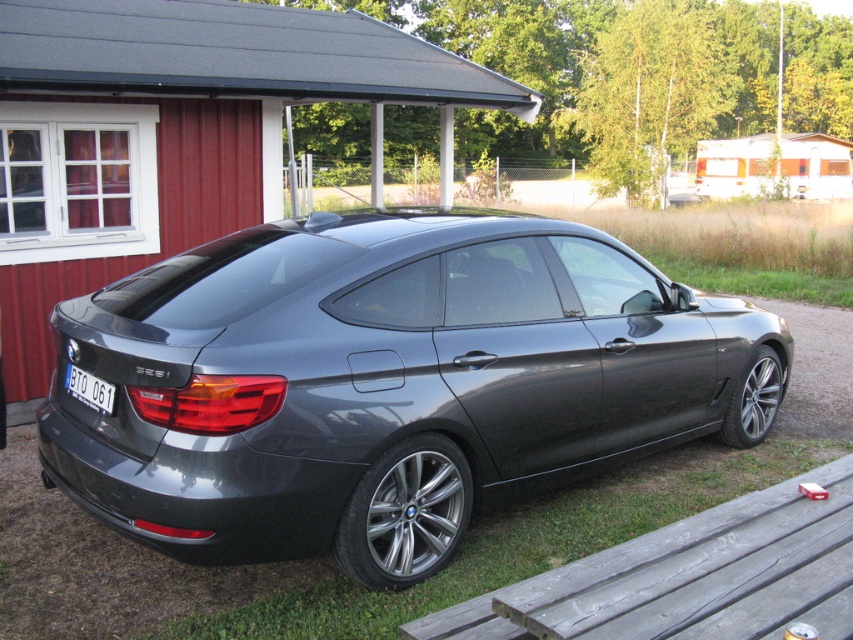
Who is positioned more to the left, red wood hut at upper left or white plastic license plate at rear?

Positioned to the left is red wood hut at upper left.

Is point (370, 65) farther from camera compared to point (103, 394)?

Yes.

This screenshot has width=853, height=640. What do you see at coordinates (171, 132) in the screenshot?
I see `red wood hut at upper left` at bounding box center [171, 132].

Find the location of `red wood hut at upper left`. red wood hut at upper left is located at coordinates tap(171, 132).

Can you confirm if satin metallic car at center is thinner than white wood trailer at upper right?

Correct, satin metallic car at center's width is less than white wood trailer at upper right's.

Is satin metallic car at center smaller than white wood trailer at upper right?

Yes, satin metallic car at center is smaller than white wood trailer at upper right.

Is point (343, 353) in front of point (815, 157)?

That is True.

At what (x,y) coordinates should I click in order to perform the action: click on satin metallic car at center. Please return your answer as a coordinate pair (x, y). Looking at the image, I should click on (386, 381).

Who is taller, satin metallic car at center or white plastic license plate at rear?

satin metallic car at center

What do you see at coordinates (386, 381) in the screenshot? I see `satin metallic car at center` at bounding box center [386, 381].

The image size is (853, 640). I want to click on satin metallic car at center, so click(386, 381).